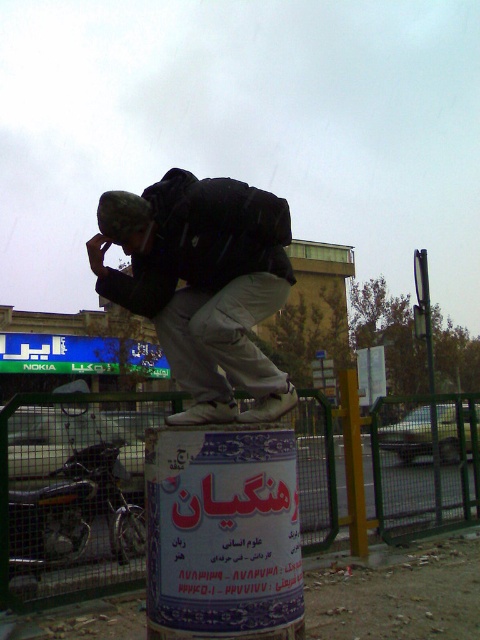
Question: Which point appears closest to the camera in this image?

Choices:
 (A) (389, 467)
 (B) (196, 360)

Answer: (B)

Question: Which of the following is the closest to the observer?

Choices:
 (A) green metal fence at lower center
 (B) matte black backpack at left

Answer: (B)

Question: Can you confirm if green metal fence at lower center is bigger than matte black backpack at left?

Choices:
 (A) yes
 (B) no

Answer: (B)

Question: Observing the image, what is the correct spatial positioning of green metal fence at lower center in reference to matte black backpack at left?

Choices:
 (A) left
 (B) right

Answer: (B)

Question: Is green metal fence at lower center positioned before matte black backpack at left?

Choices:
 (A) yes
 (B) no

Answer: (B)